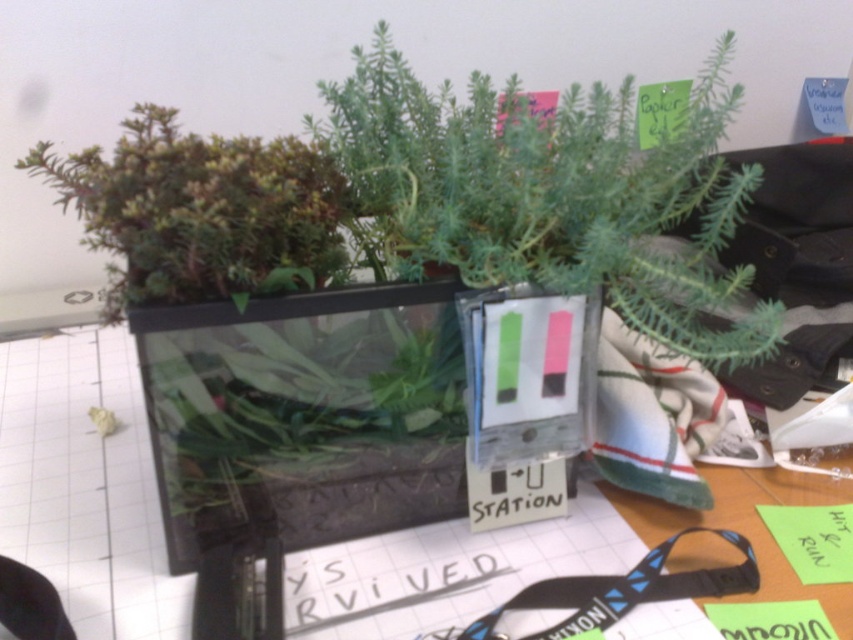
Question: Is green matte plant at center thinner than green matte plant at upper left?

Choices:
 (A) yes
 (B) no

Answer: (B)

Question: Can you confirm if green matte plant at center is positioned below green matte plant at upper left?

Choices:
 (A) yes
 (B) no

Answer: (B)

Question: Does green matte plant at center appear over green matte plant at upper left?

Choices:
 (A) no
 (B) yes

Answer: (B)

Question: Which object is farther from the camera taking this photo?

Choices:
 (A) green matte plant at upper left
 (B) green matte plant at center

Answer: (B)

Question: Which of the following is the farthest from the observer?

Choices:
 (A) green matte plant at center
 (B) green matte plant at upper left

Answer: (A)